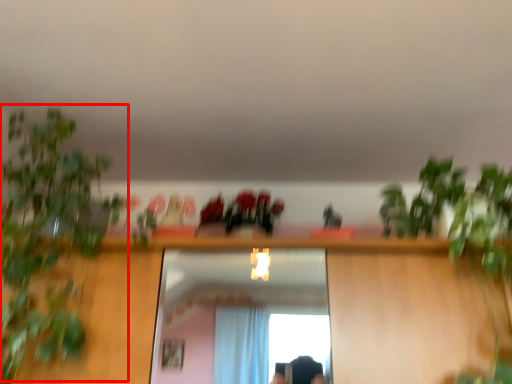
Question: From the image, what is the correct spatial relationship of vegetation (annotated by the red box) in relation to flower?

Choices:
 (A) right
 (B) left

Answer: (B)